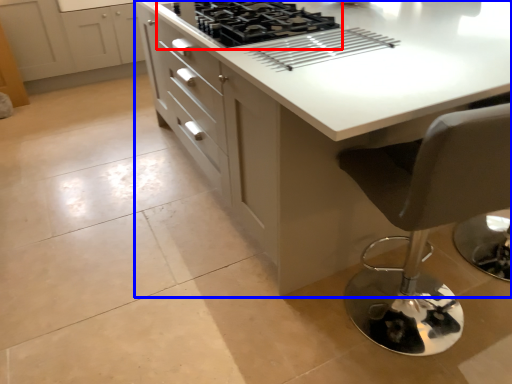
Question: Which of the following is the closest to the observer, gas stove (highlighted by a red box) or countertop (highlighted by a blue box)?

Choices:
 (A) gas stove
 (B) countertop

Answer: (B)